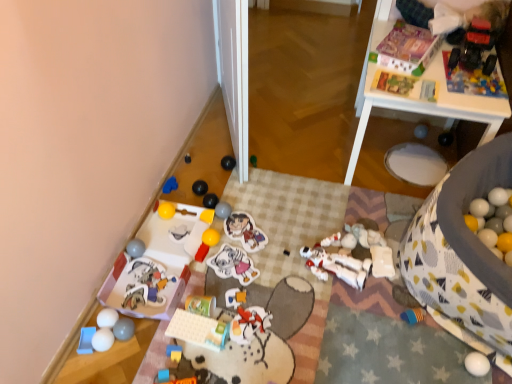
Locate an element on the screen. unoccupied space behind white matte doll at center, acting as the 22th toy starting from the left is located at coordinates (325, 218).